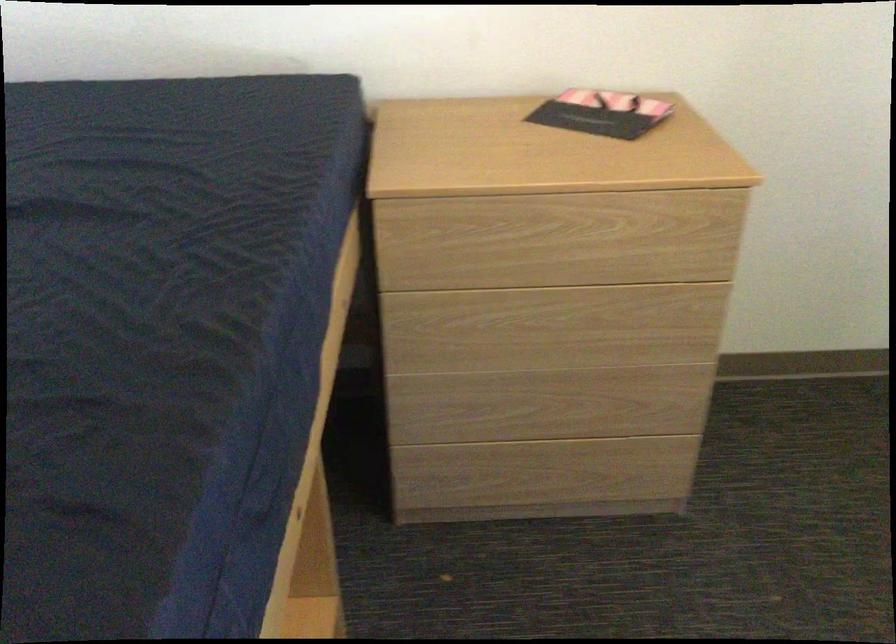
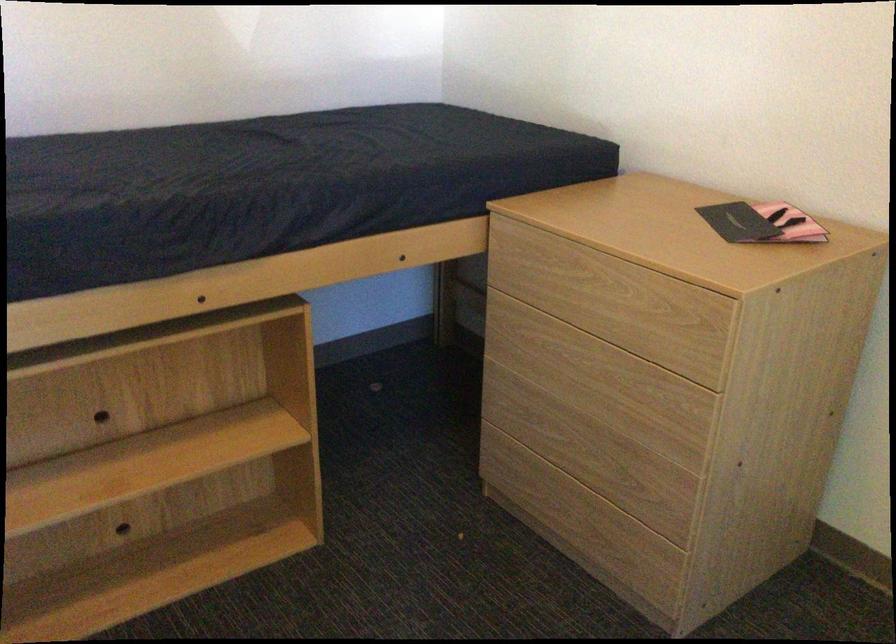
In the second image, find the point that corresponds to pixel 622 111 in the first image.

(762, 223)